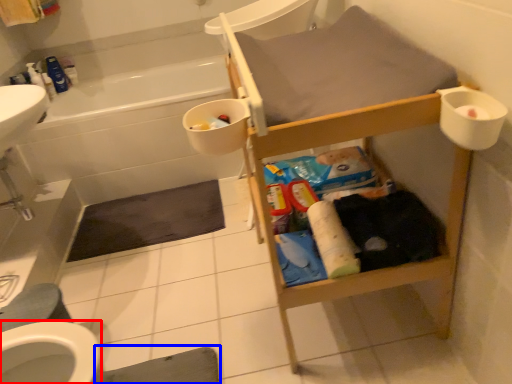
Question: Which point is further to the camera, bidet (highlighted by a red box) or bath mat (highlighted by a blue box)?

Choices:
 (A) bidet
 (B) bath mat

Answer: (A)